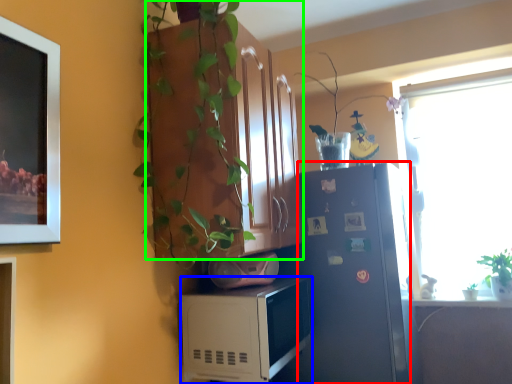
Question: Which is farther away from refrigerator (highlighted by a red box)? microwave oven (highlighted by a blue box) or cabinetry (highlighted by a green box)?

Choices:
 (A) microwave oven
 (B) cabinetry

Answer: (B)